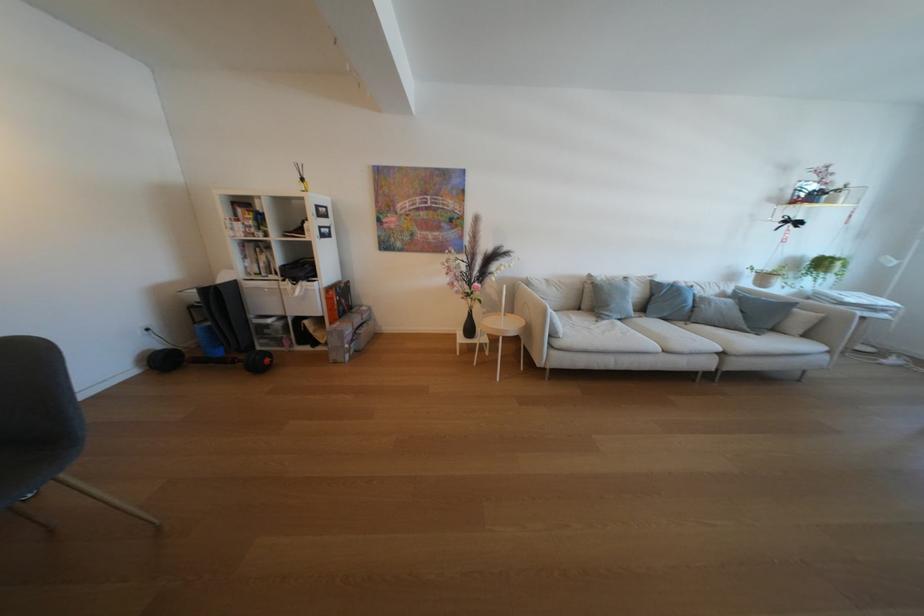
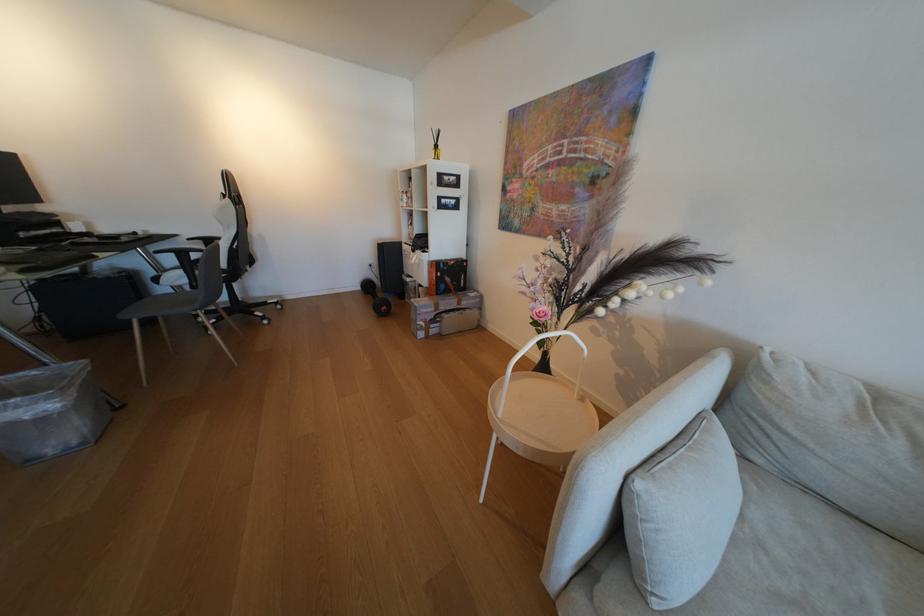
In the second image, find the point that corresponds to pixel 572 338 in the first image.

(665, 604)